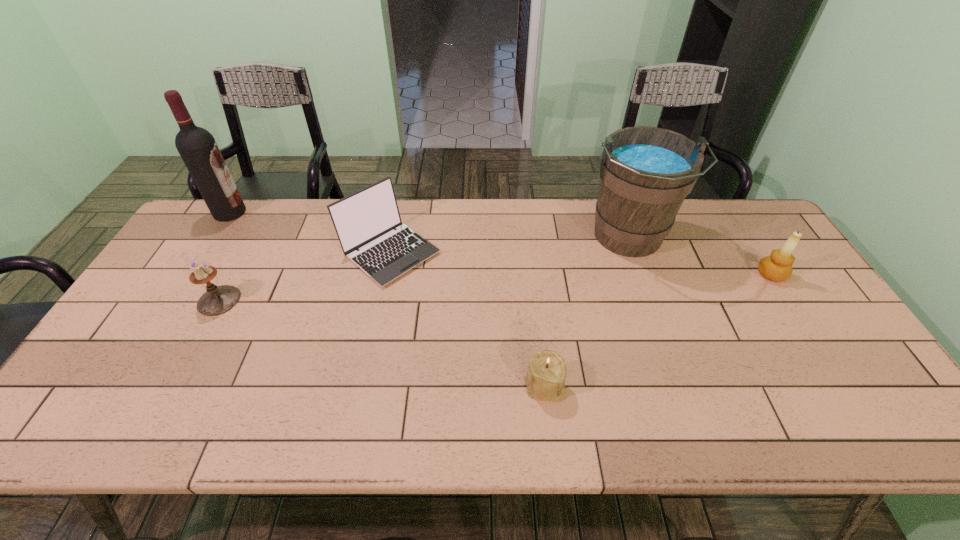
This screenshot has width=960, height=540. I want to click on vacant space located 0.290m with a handle on the side of the wine bucket, so click(670, 356).

This screenshot has width=960, height=540. I want to click on vacant space located 0.200m at the front screen of the fourth object from right to left, so click(x=371, y=348).

This screenshot has width=960, height=540. What are the coordinates of `free space located on the right of the fifth object from right to left` in the screenshot? It's located at (294, 300).

Image resolution: width=960 pixels, height=540 pixels. I want to click on vacant space located on the front of the rightmost object, so click(854, 405).

Find the location of a particular element. Image resolution: width=960 pixels, height=540 pixels. vacant space situated on the right of the second candle_holder from left to right is located at coordinates (688, 385).

At what (x,y) coordinates should I click in order to perform the action: click on wine bottle located in the far edge section of the desktop. Please return your answer as a coordinate pair (x, y). This screenshot has width=960, height=540. Looking at the image, I should click on (198, 149).

The width and height of the screenshot is (960, 540). I want to click on wine bucket that is at the far edge, so click(x=646, y=172).

Where is `laptop_computer positioned at the far edge`? laptop_computer positioned at the far edge is located at coordinates (365, 220).

I want to click on object at the near edge, so click(x=545, y=379).

You are a GUI agent. You are given a task and a screenshot of the screen. Output one action in this format:
    pyautogui.click(x=<x>, y=<y>)
    Task: Click on the wine bottle located in the left edge section of the desktop
    
    Given the screenshot: What is the action you would take?
    pyautogui.click(x=198, y=149)